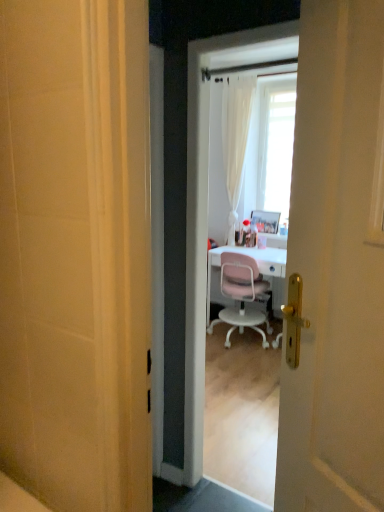
Question: Should I look upward or downward to see metallic silver picture frame at center?

Choices:
 (A) up
 (B) down

Answer: (A)

Question: Is pink plastic chair at center turned away from metallic silver picture frame at center?

Choices:
 (A) yes
 (B) no

Answer: (B)

Question: From the image's perspective, is pink plastic chair at center beneath metallic silver picture frame at center?

Choices:
 (A) no
 (B) yes

Answer: (B)

Question: From a real-world perspective, is pink plastic chair at center under metallic silver picture frame at center?

Choices:
 (A) yes
 (B) no

Answer: (A)

Question: Does pink plastic chair at center have a greater height compared to metallic silver picture frame at center?

Choices:
 (A) yes
 (B) no

Answer: (A)

Question: Is pink plastic chair at center behind metallic silver picture frame at center?

Choices:
 (A) yes
 (B) no

Answer: (B)

Question: From a real-world perspective, is pink plastic chair at center on metallic silver picture frame at center?

Choices:
 (A) yes
 (B) no

Answer: (B)

Question: Would you say pink plastic chair at center is part of metallic silver picture frame at center's contents?

Choices:
 (A) yes
 (B) no

Answer: (B)

Question: Does metallic silver picture frame at center have a lesser height compared to pink plastic chair at center?

Choices:
 (A) no
 (B) yes

Answer: (B)

Question: From a real-world perspective, is metallic silver picture frame at center on pink plastic chair at center?

Choices:
 (A) yes
 (B) no

Answer: (A)

Question: Is metallic silver picture frame at center not near pink plastic chair at center?

Choices:
 (A) no
 (B) yes

Answer: (A)

Question: Is metallic silver picture frame at center wider than pink plastic chair at center?

Choices:
 (A) no
 (B) yes

Answer: (A)

Question: Could you tell me if metallic silver picture frame at center is turned towards pink plastic chair at center?

Choices:
 (A) yes
 (B) no

Answer: (B)

Question: From the image's perspective, relative to pink plastic chair at center, is metallic silver picture frame at center above or below?

Choices:
 (A) above
 (B) below

Answer: (A)